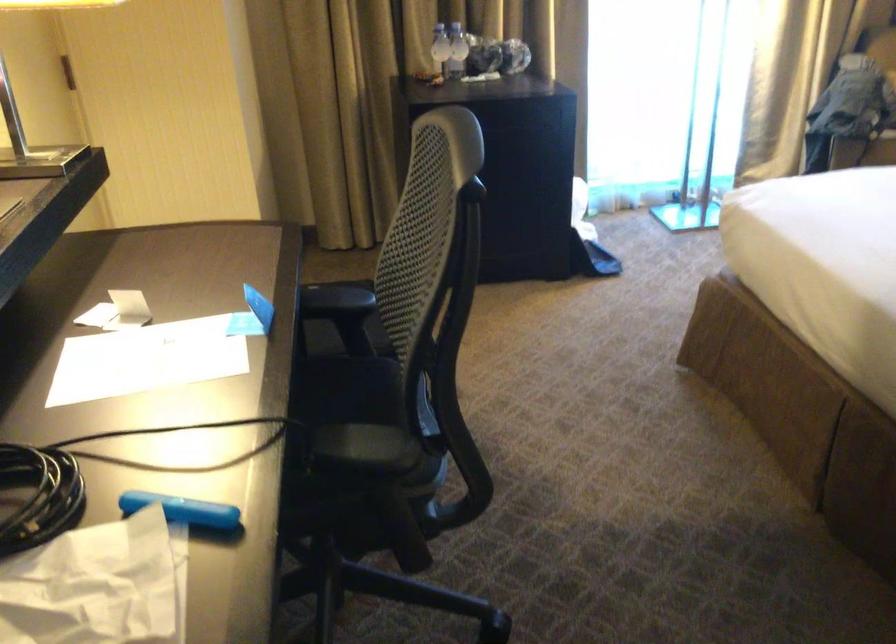
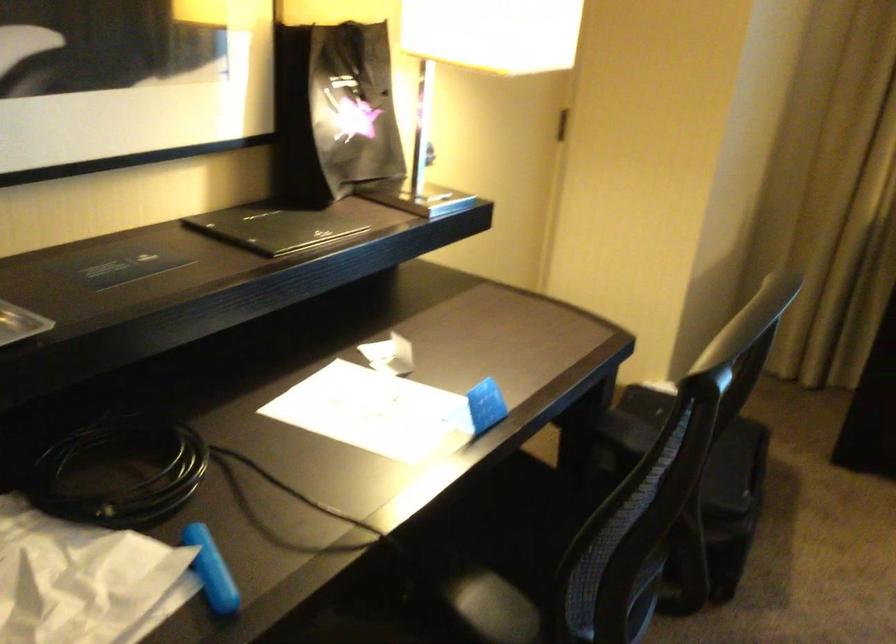
Where in the second image is the point corresponding to the point at 178,507 from the first image?

(211, 570)